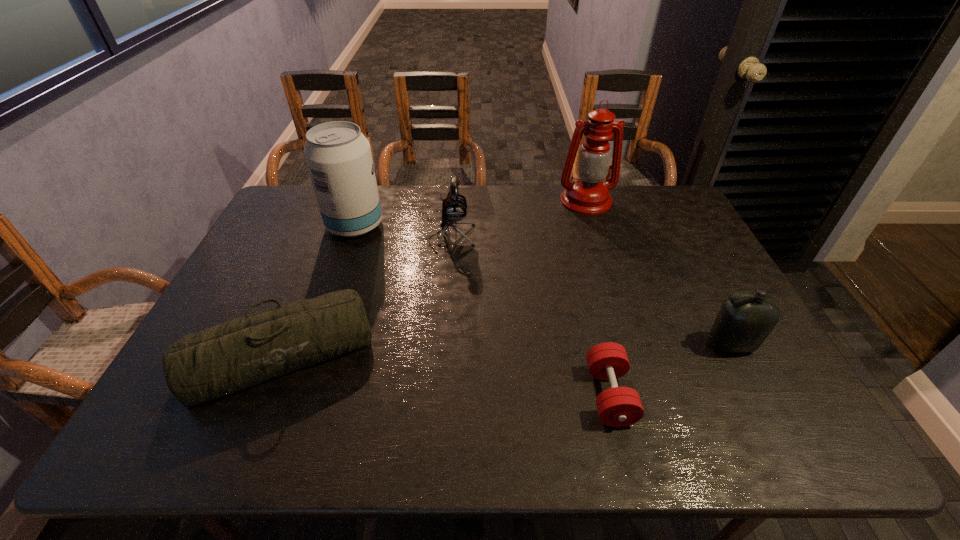
Find the location of a particular element. free space located 0.130m on the back of the duffel bag is located at coordinates (314, 276).

At what (x,y) coordinates should I click in order to perform the action: click on vacant position located on the back of the dumbbell. Please return your answer as a coordinate pair (x, y). The height and width of the screenshot is (540, 960). Looking at the image, I should click on (588, 304).

Where is `oil lamp that is at the far edge`? Image resolution: width=960 pixels, height=540 pixels. oil lamp that is at the far edge is located at coordinates (588, 195).

Identify the location of alcohol that is positioned at the far edge. (338, 156).

The height and width of the screenshot is (540, 960). I want to click on object present at the near edge, so 618,406.

Where is `object that is at the left edge`? Image resolution: width=960 pixels, height=540 pixels. object that is at the left edge is located at coordinates (232, 356).

Find the location of a particular element. This screenshot has width=960, height=540. object present at the right edge is located at coordinates (745, 319).

At what (x,y) coordinates should I click in order to perform the action: click on free space at the far edge. Please return your answer as a coordinate pair (x, y). Looking at the image, I should click on (469, 207).

Locate an element on the screen. free space at the near edge is located at coordinates (568, 446).

Identify the location of free point at the left edge. (264, 271).